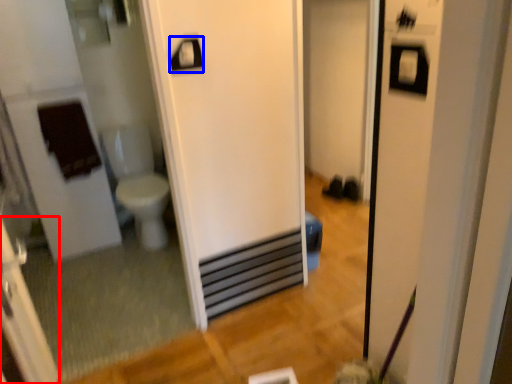
Question: Among these objects, which one is nearest to the camera, screen door (highlighted by a red box) or towel bar (highlighted by a blue box)?

Choices:
 (A) screen door
 (B) towel bar

Answer: (A)